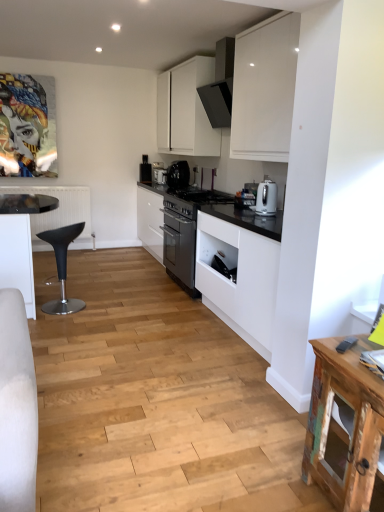
This screenshot has height=512, width=384. Describe the element at coordinates (178, 175) in the screenshot. I see `satin black coffee maker at center, positioned as the 2th kitchen appliance in left-to-right order` at that location.

Identify the location of white glossy coffee maker at center, the 3th kitchen appliance in the right-to-left sequence. (160, 175).

From the picture: What is the approximate width of black plastic bar stool at left?

It is 15.30 inches.

Describe the element at coordinates (186, 110) in the screenshot. I see `white matte cabinet at upper center` at that location.

The image size is (384, 512). I want to click on black matte toaster at upper center, so 145,170.

Considering the relative sizes of white matte cabinet at upper center and black matte toaster at upper center in the image provided, is white matte cabinet at upper center smaller than black matte toaster at upper center?

Actually, white matte cabinet at upper center might be larger than black matte toaster at upper center.

How much distance is there between white matte cabinet at upper center and black matte toaster at upper center?

36.74 inches.

The image size is (384, 512). Find the location of `cabinetry lying on the right of black matte toaster at upper center`. cabinetry lying on the right of black matte toaster at upper center is located at coordinates (186, 110).

Considering the relative sizes of white matte cabinet at upper center and black matte toaster at upper center in the image provided, is white matte cabinet at upper center taller than black matte toaster at upper center?

Indeed, white matte cabinet at upper center has a greater height compared to black matte toaster at upper center.

At what (x,y) coordinates should I click in order to perform the action: click on the 2nd kitchen appliance behind when counting from the black plastic bar stool at left. Please return your answer as a coordinate pair (x, y). The height and width of the screenshot is (512, 384). Looking at the image, I should click on (160, 175).

Does white glossy coffee maker at center, the 3th kitchen appliance in the right-to-left sequence, have a greater width compared to black plastic bar stool at left?

In fact, white glossy coffee maker at center, the 3th kitchen appliance in the right-to-left sequence, might be narrower than black plastic bar stool at left.

Looking at the image, does white glossy coffee maker at center, acting as the 3th kitchen appliance starting from the bottom, seem bigger or smaller compared to black plastic bar stool at left?

white glossy coffee maker at center, acting as the 3th kitchen appliance starting from the bottom, is smaller than black plastic bar stool at left.

Which point is more forward, (276, 194) or (62, 246)?

The point (276, 194) is closer.

From a real-world perspective, between satin silver kettle at right, which is the 1th kitchen appliance in front-to-back order, and black plastic bar stool at left, who is vertically higher?

satin silver kettle at right, which is the 1th kitchen appliance in front-to-back order, is physically above.

In terms of size, does satin silver kettle at right, which ranks as the 3th kitchen appliance in back-to-front order, appear bigger or smaller than black plastic bar stool at left?

Clearly, satin silver kettle at right, which ranks as the 3th kitchen appliance in back-to-front order, is smaller in size than black plastic bar stool at left.

Is the surface of satin silver kettle at right, acting as the 3th kitchen appliance starting from the top, in direct contact with black plastic bar stool at left?

No, satin silver kettle at right, acting as the 3th kitchen appliance starting from the top, is not with black plastic bar stool at left.

Is black matte toaster at upper center far away from satin silver kettle at right, placed as the 1th kitchen appliance when sorted from bottom to top?

That's right, there is a large distance between black matte toaster at upper center and satin silver kettle at right, placed as the 1th kitchen appliance when sorted from bottom to top.

From a real-world perspective, is black matte toaster at upper center over satin silver kettle at right, the 1th kitchen appliance from the right?

No, from a real-world perspective, black matte toaster at upper center is not over satin silver kettle at right, the 1th kitchen appliance from the right

Does point (150, 166) appear closer or farther from the camera than point (263, 210)?

Point (150, 166) appears to be farther away from the viewer than point (263, 210).

Based on the photo, is black matte toaster at upper center wider than satin silver kettle at right, the 1th kitchen appliance from the right?

In fact, black matte toaster at upper center might be narrower than satin silver kettle at right, the 1th kitchen appliance from the right.

Is white glossy coffee maker at center, placed as the 1th kitchen appliance when sorted from back to front, turned away from black matte toaster at upper center?

No, white glossy coffee maker at center, placed as the 1th kitchen appliance when sorted from back to front, is not facing away from black matte toaster at upper center.

Considering the positions of point (160, 169) and point (147, 178), is point (160, 169) closer or farther from the camera than point (147, 178)?

Clearly, point (160, 169) is more distant from the camera than point (147, 178).

Is white glossy coffee maker at center, placed as the 1th kitchen appliance when sorted from back to front, touching black matte toaster at upper center?

No, white glossy coffee maker at center, placed as the 1th kitchen appliance when sorted from back to front, is not making contact with black matte toaster at upper center.

The image size is (384, 512). I want to click on appliance located above the white glossy coffee maker at center, the 3th kitchen appliance in the right-to-left sequence (from a real-world perspective), so click(145, 170).

There is a satin silver kettle at right, placed as the 1th kitchen appliance when sorted from bottom to top. At what (x,y) coordinates should I click in order to perform the action: click on the 2nd kitchen appliance above it (from the image's perspective). Please return your answer as a coordinate pair (x, y). Looking at the image, I should click on (160, 175).

Between point (272, 214) and point (166, 172), which one is positioned behind?

Point (166, 172)

Is satin silver kettle at right, acting as the 3th kitchen appliance starting from the top, bigger than white glossy coffee maker at center, which ranks as the third kitchen appliance in front-to-back order?

No, satin silver kettle at right, acting as the 3th kitchen appliance starting from the top, is not bigger than white glossy coffee maker at center, which ranks as the third kitchen appliance in front-to-back order.

Is white matte cabinet at upper center with satin black coffee maker at center, the second kitchen appliance positioned from the bottom?

No, white matte cabinet at upper center is not touching satin black coffee maker at center, the second kitchen appliance positioned from the bottom.

Which of these two, white matte cabinet at upper center or satin black coffee maker at center, the 2th kitchen appliance positioned from the front, is smaller?

Smaller between the two is satin black coffee maker at center, the 2th kitchen appliance positioned from the front.

Starting from the white matte cabinet at upper center, which kitchen appliance is the 1st one behind? Please provide its 2D coordinates.

[(178, 175)]

Where is `cabinetry above the black matte toaster at upper center (from a real-world perspective)`? This screenshot has width=384, height=512. cabinetry above the black matte toaster at upper center (from a real-world perspective) is located at coordinates (186, 110).

At what (x,y) coordinates should I click in order to perform the action: click on bar stool in front of the white glossy coffee maker at center, positioned as the first kitchen appliance in top-to-bottom order. Please return your answer as a coordinate pair (x, y). This screenshot has width=384, height=512. Looking at the image, I should click on (62, 267).

Which object lies nearer to the anchor point satin silver kettle at right, the 1th kitchen appliance from the right, satin black coffee maker at center, the 2th kitchen appliance positioned from the front, or white matte cabinet at upper center?

satin black coffee maker at center, the 2th kitchen appliance positioned from the front, lies closer to satin silver kettle at right, the 1th kitchen appliance from the right, than the other object.

Consider the image. Based on their spatial positions, is black plastic bar stool at left or satin silver kettle at right, the 1th kitchen appliance from the right, closer to satin black coffee maker at center, the 2th kitchen appliance positioned from the back?

black plastic bar stool at left lies closer to satin black coffee maker at center, the 2th kitchen appliance positioned from the back, than the other object.

Which object lies further to the anchor point black plastic bar stool at left, satin black coffee maker at center, the 2th kitchen appliance from the right, or white glossy coffee maker at center, which ranks as the third kitchen appliance in front-to-back order?

white glossy coffee maker at center, which ranks as the third kitchen appliance in front-to-back order, lies further to black plastic bar stool at left than the other object.

Based on their spatial positions, is white matte cabinet at upper center or satin silver kettle at right, placed as the 1th kitchen appliance when sorted from bottom to top, closer to white glossy coffee maker at center, placed as the 1th kitchen appliance when sorted from back to front?

Based on the image, white matte cabinet at upper center appears to be nearer to white glossy coffee maker at center, placed as the 1th kitchen appliance when sorted from back to front.

When comparing their distances from white matte cabinet at upper center, does black plastic bar stool at left or white glossy coffee maker at center, positioned as the first kitchen appliance in top-to-bottom order, seem further?

black plastic bar stool at left.

Based on the photo, when comparing their distances from satin black coffee maker at center, the 2th kitchen appliance positioned from the back, does white glossy coffee maker at center, the first kitchen appliance when ordered from left to right, or white matte cabinet at upper center seem further?

white matte cabinet at upper center lies further to satin black coffee maker at center, the 2th kitchen appliance positioned from the back, than the other object.

Estimate the real-world distances between objects in this image. Which object is closer to black matte toaster at upper center, white matte cabinet at upper center or satin black coffee maker at center, positioned as the 2th kitchen appliance in left-to-right order?

→ Among the two, satin black coffee maker at center, positioned as the 2th kitchen appliance in left-to-right order, is located nearer to black matte toaster at upper center.

Which object lies further to the anchor point satin silver kettle at right, which is the 3th kitchen appliance from left to right, black plastic bar stool at left or white glossy coffee maker at center, which ranks as the third kitchen appliance in front-to-back order?

white glossy coffee maker at center, which ranks as the third kitchen appliance in front-to-back order, is further to satin silver kettle at right, which is the 3th kitchen appliance from left to right.

This screenshot has height=512, width=384. I want to click on bar stool between satin silver kettle at right, which is the 1th kitchen appliance in front-to-back order, and satin black coffee maker at center, the 2th kitchen appliance from the right, in the front-back direction, so click(x=62, y=267).

At what (x,y) coordinates should I click in order to perform the action: click on bar stool positioned between satin silver kettle at right, the 1th kitchen appliance from the right, and white glossy coffee maker at center, which ranks as the third kitchen appliance in front-to-back order, from near to far. Please return your answer as a coordinate pair (x, y). Looking at the image, I should click on (62, 267).

You are a GUI agent. You are given a task and a screenshot of the screen. Output one action in this format:
    pyautogui.click(x=<x>, y=<y>)
    Task: Click on the kitchen appliance between black plastic bar stool at left and white glossy coffee maker at center, placed as the 1th kitchen appliance when sorted from back to front, along the z-axis
    
    Given the screenshot: What is the action you would take?
    pyautogui.click(x=178, y=175)

This screenshot has height=512, width=384. I want to click on cabinetry between satin silver kettle at right, which is the 3th kitchen appliance from left to right, and white glossy coffee maker at center, acting as the 3th kitchen appliance starting from the bottom, in the front-back direction, so 186,110.